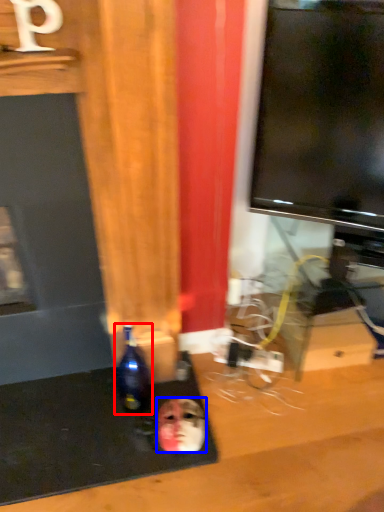
Question: Which object is further to the camera taking this photo, bottle (highlighted by a red box) or human face (highlighted by a blue box)?

Choices:
 (A) bottle
 (B) human face

Answer: (B)